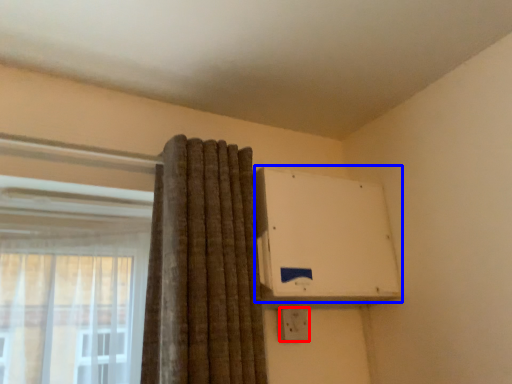
Question: Which object is closer to the camera taking this photo, electric outlet (highlighted by a red box) or air conditioning (highlighted by a blue box)?

Choices:
 (A) electric outlet
 (B) air conditioning

Answer: (B)